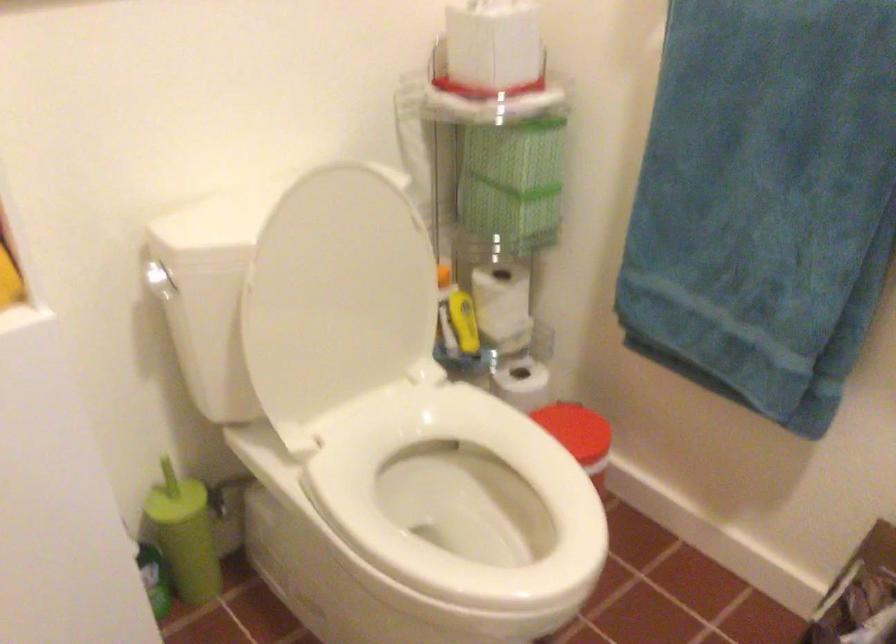
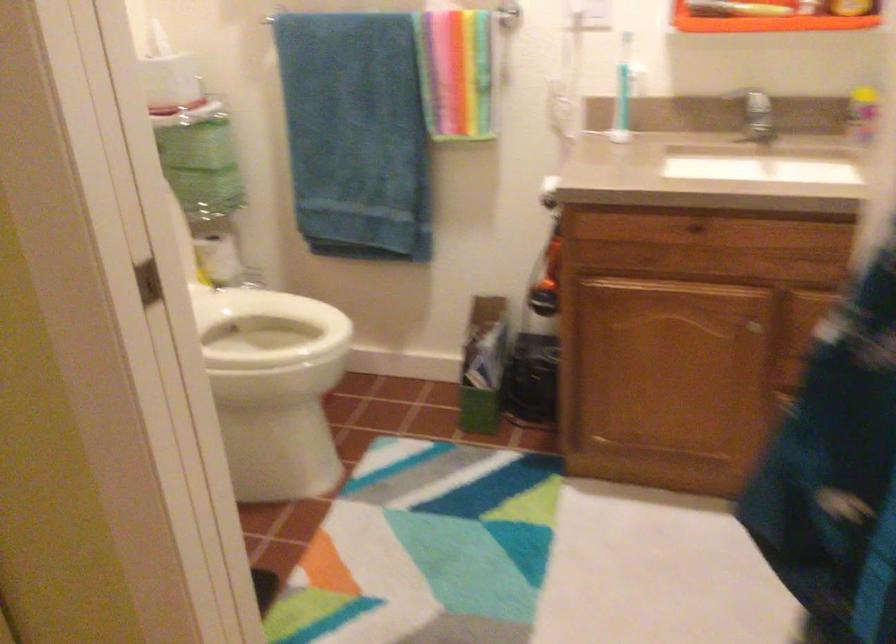
Locate, in the second image, the point that corresponds to (510,149) in the first image.

(196, 145)